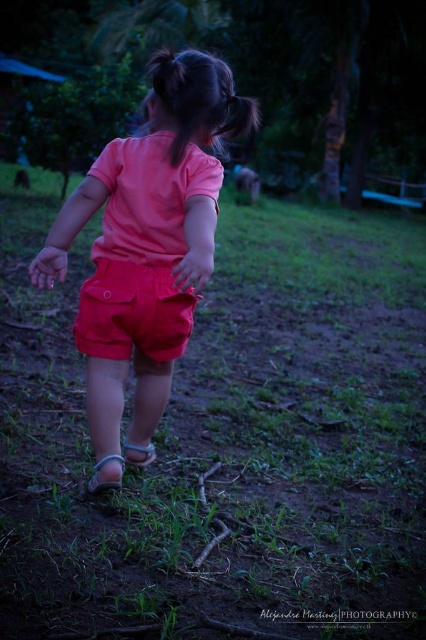
Is point (408, 250) positioned before point (164, 310)?

No, (408, 250) is further to viewer.

Is green grass at center above matte cotton shorts at center?

Indeed, green grass at center is positioned over matte cotton shorts at center.

The width and height of the screenshot is (426, 640). What do you see at coordinates (226, 440) in the screenshot?
I see `green grass at center` at bounding box center [226, 440].

Identify the location of green grass at center. Image resolution: width=426 pixels, height=640 pixels. (226, 440).

Can you confirm if green grass at center is positioned above coral fabric shorts at center?

Yes.

Does green grass at center have a larger size compared to coral fabric shorts at center?

Indeed, green grass at center has a larger size compared to coral fabric shorts at center.

The image size is (426, 640). I want to click on green grass at center, so click(226, 440).

Which of these two, green grass at center or black silky hair at upper center, stands taller?

With more height is black silky hair at upper center.

Is green grass at center below black silky hair at upper center?

Indeed, green grass at center is positioned under black silky hair at upper center.

This screenshot has width=426, height=640. What do you see at coordinates (226, 440) in the screenshot?
I see `green grass at center` at bounding box center [226, 440].

Locate an element on the screen. This screenshot has height=640, width=426. green grass at center is located at coordinates (226, 440).